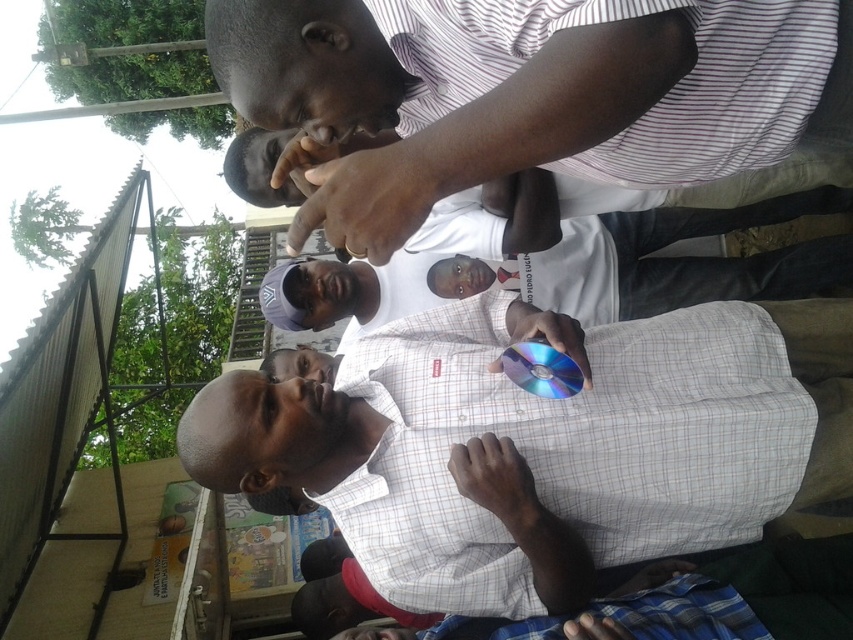
Measure the distance between white checkered shirt at center and camera.

white checkered shirt at center and camera are 4.74 feet apart.

Where is `white checkered shirt at center`? white checkered shirt at center is located at coordinates (544, 440).

Between point (717, 339) and point (387, 212), which one is positioned behind?

The point (717, 339) is more distant.

At what (x,y) coordinates should I click in order to perform the action: click on white checkered shirt at center. Please return your answer as a coordinate pair (x, y). Looking at the image, I should click on (544, 440).